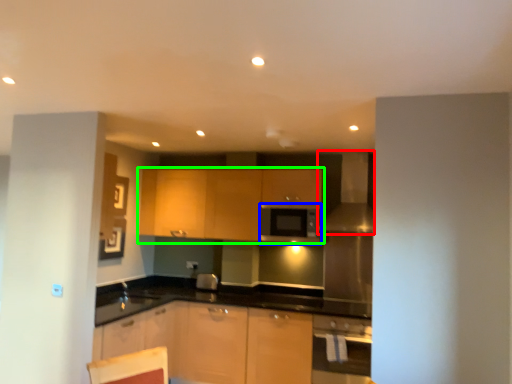
Question: Considering the real-world distances, which object is closest to exhaust hood (highlighted by a red box)? appliance (highlighted by a blue box) or cabinetry (highlighted by a green box).

Choices:
 (A) appliance
 (B) cabinetry

Answer: (A)